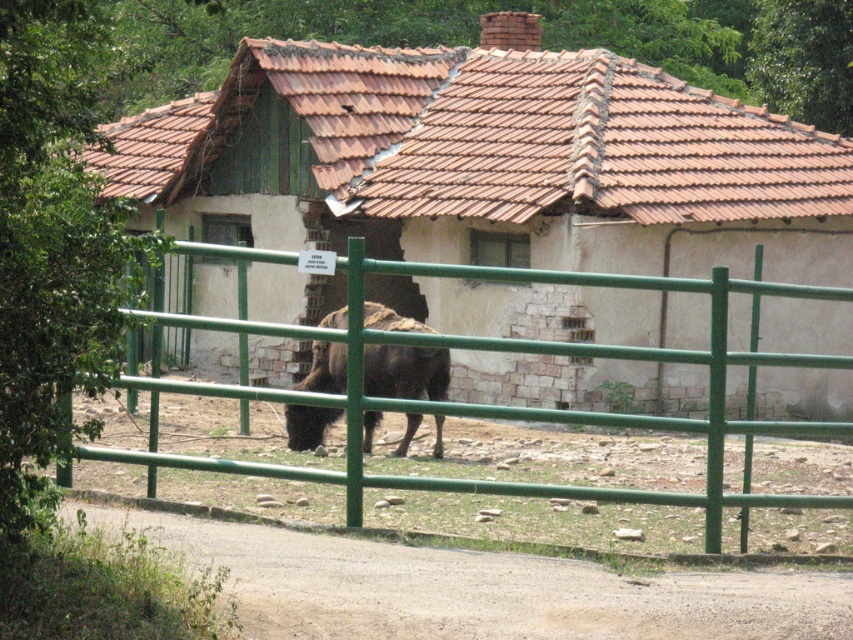
Does green metal fence at center appear under brown furry yak at center?

No.

Who is more forward, (361,483) or (306,410)?

Positioned in front is point (361,483).

Does point (714, 412) come closer to viewer compared to point (416, 374)?

Yes, it is.

Locate an element on the screen. Image resolution: width=853 pixels, height=640 pixels. green metal fence at center is located at coordinates (518, 406).

Between white stone hut at center and green metal fence at center, which one has less height?

white stone hut at center

Can you confirm if white stone hut at center is positioned below green metal fence at center?

No, white stone hut at center is not below green metal fence at center.

Is point (165, 150) positioned before point (412, 340)?

No.

Identify the location of white stone hut at center. Image resolution: width=853 pixels, height=640 pixels. (489, 161).

Is white stone hut at center shorter than brown furry yak at center?

Correct, white stone hut at center is not as tall as brown furry yak at center.

Who is more distant from viewer, (548, 243) or (368, 449)?

Positioned behind is point (548, 243).

The image size is (853, 640). What are the coordinates of `white stone hut at center` in the screenshot? It's located at (489, 161).